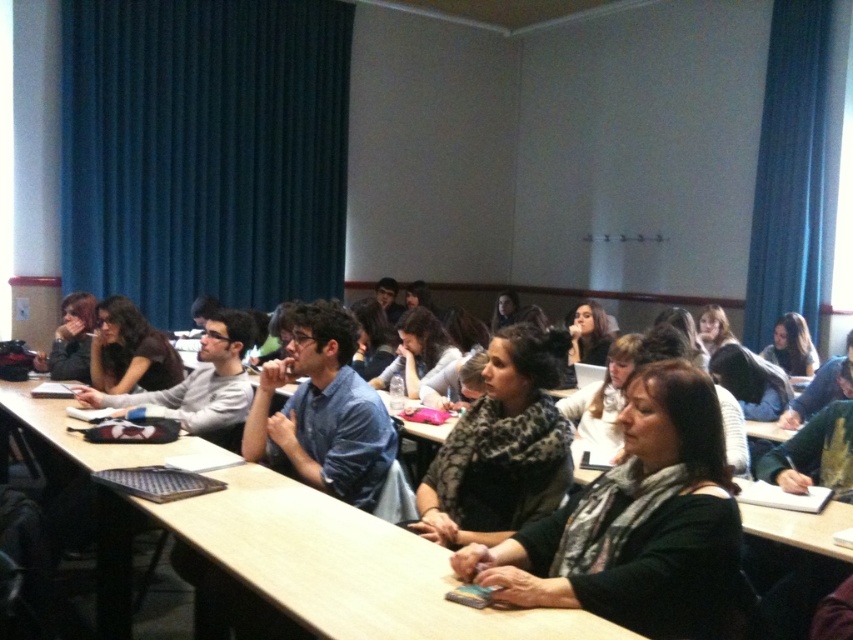
What do you see at coordinates (204, 150) in the screenshot?
I see `blue fabric curtain at upper left` at bounding box center [204, 150].

Does blue fabric curtain at upper left have a larger size compared to wooden table at center?

Correct, blue fabric curtain at upper left is larger in size than wooden table at center.

Which is in front, point (200, 172) or point (457, 605)?

Point (457, 605) is more forward.

Find the location of `blue fabric curtain at upper left`. blue fabric curtain at upper left is located at coordinates (204, 150).

Does blue fabric curtain at upper left have a lesser width compared to matte black shirt at center?

No.

Can you confirm if blue fabric curtain at upper left is positioned above matte black shirt at center?

Correct, blue fabric curtain at upper left is located above matte black shirt at center.

The height and width of the screenshot is (640, 853). What are the coordinates of `blue fabric curtain at upper left` in the screenshot? It's located at (204, 150).

You are a GUI agent. You are given a task and a screenshot of the screen. Output one action in this format:
    pyautogui.click(x=<x>, y=<y>)
    Task: Click on the blue fabric curtain at upper left
    
    Given the screenshot: What is the action you would take?
    pyautogui.click(x=204, y=150)

Is black matte scarf at center further to the viewer compared to dark gray scarf at center?

No, black matte scarf at center is in front of dark gray scarf at center.

Is point (677, 557) more distant than point (570, 472)?

No, (677, 557) is closer to viewer.

At what (x,y) coordinates should I click in order to perform the action: click on black matte scarf at center. Please return your answer as a coordinate pair (x, y). Image resolution: width=853 pixels, height=640 pixels. Looking at the image, I should click on (636, 524).